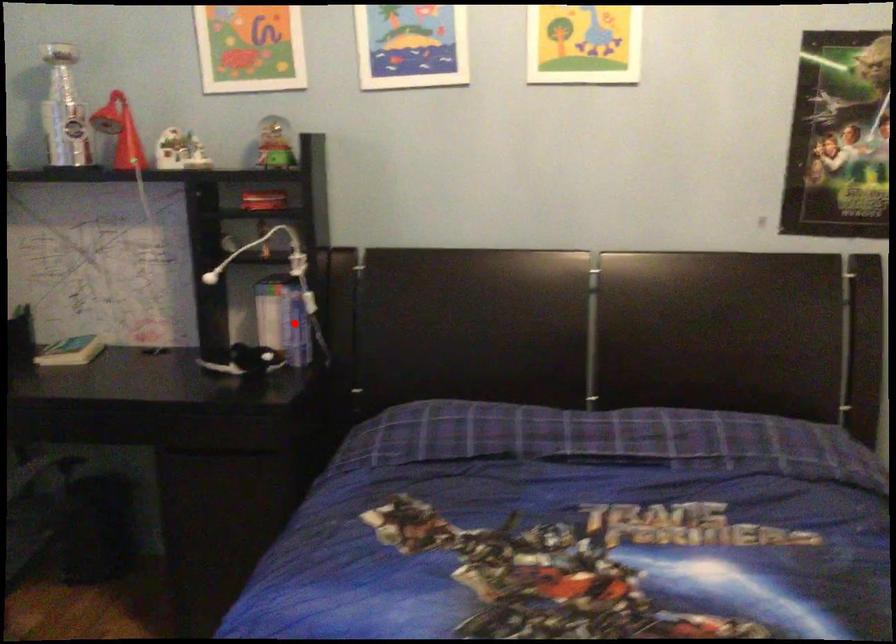
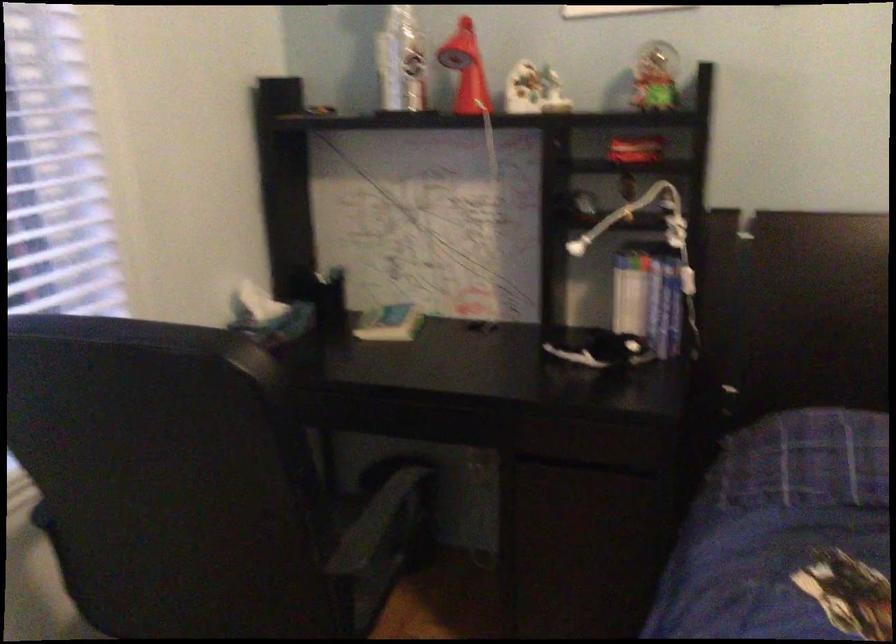
Locate, in the second image, the point that corresponds to the highlighted location in the first image.

(664, 307)